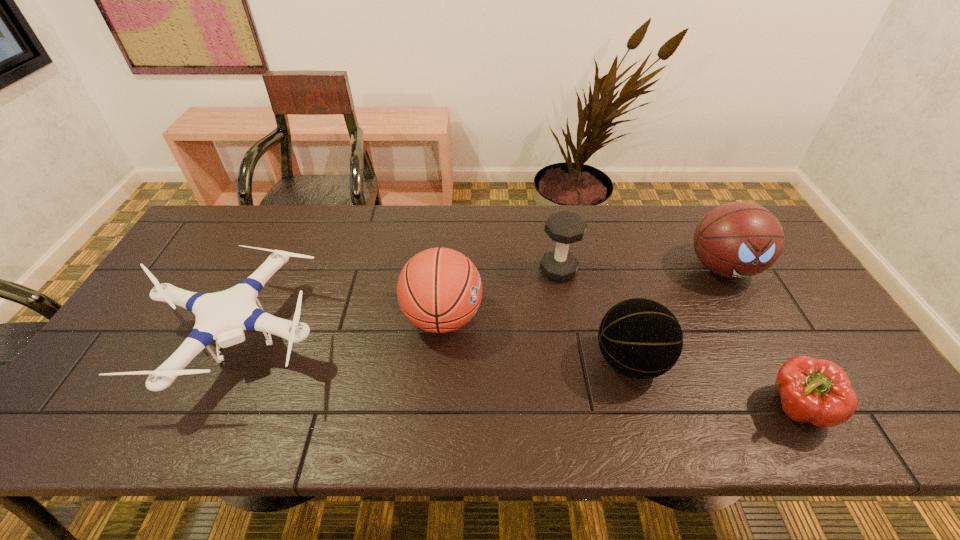
At what (x,y) coordinates should I click in order to perform the action: click on the rightmost basketball. Please return your answer as a coordinate pair (x, y). Looking at the image, I should click on (738, 239).

Where is `the leftmost basketball`? The image size is (960, 540). the leftmost basketball is located at coordinates (439, 290).

You are a GUI agent. You are given a task and a screenshot of the screen. Output one action in this format:
    pyautogui.click(x=<x>, y=<y>)
    Task: Click on the dumbbell
    Image resolution: width=960 pixels, height=540 pixels.
    Given the screenshot: What is the action you would take?
    pyautogui.click(x=564, y=227)

Identify the location of the second basketball from left to right. (640, 338).

The width and height of the screenshot is (960, 540). What are the coordinates of `the leftmost object` in the screenshot? It's located at (223, 316).

The width and height of the screenshot is (960, 540). Identify the location of pepper. (815, 391).

Locate an element on the screen. free region located 0.180m on the left of the rightmost basketball is located at coordinates (626, 268).

The height and width of the screenshot is (540, 960). Find the location of `vacant space located on the logo side of the second object from left to right`. vacant space located on the logo side of the second object from left to right is located at coordinates (549, 318).

Where is `vacant region located on the front of the dumbbell`? The width and height of the screenshot is (960, 540). vacant region located on the front of the dumbbell is located at coordinates (570, 337).

Locate an element on the screen. vacant space located on the back of the second basketball from right to left is located at coordinates (602, 264).